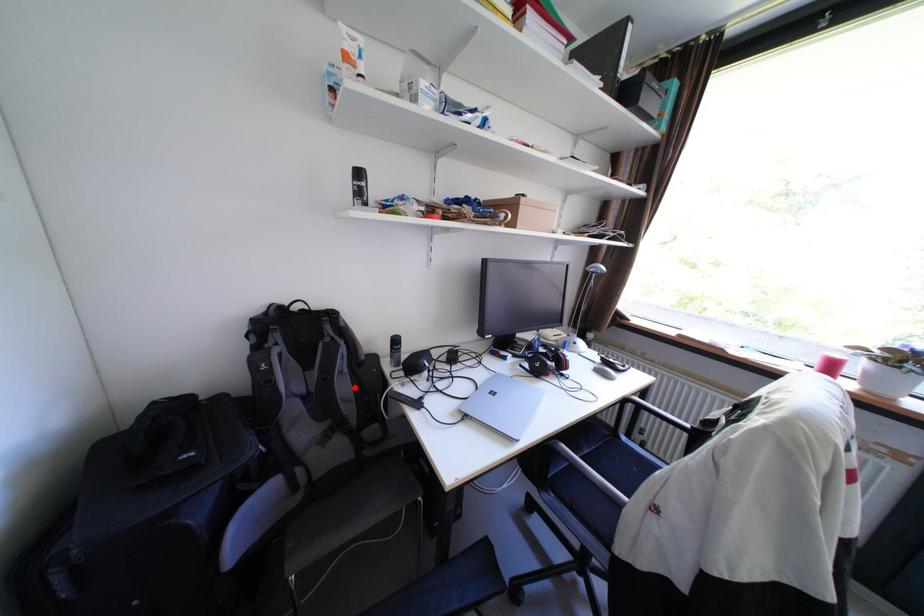
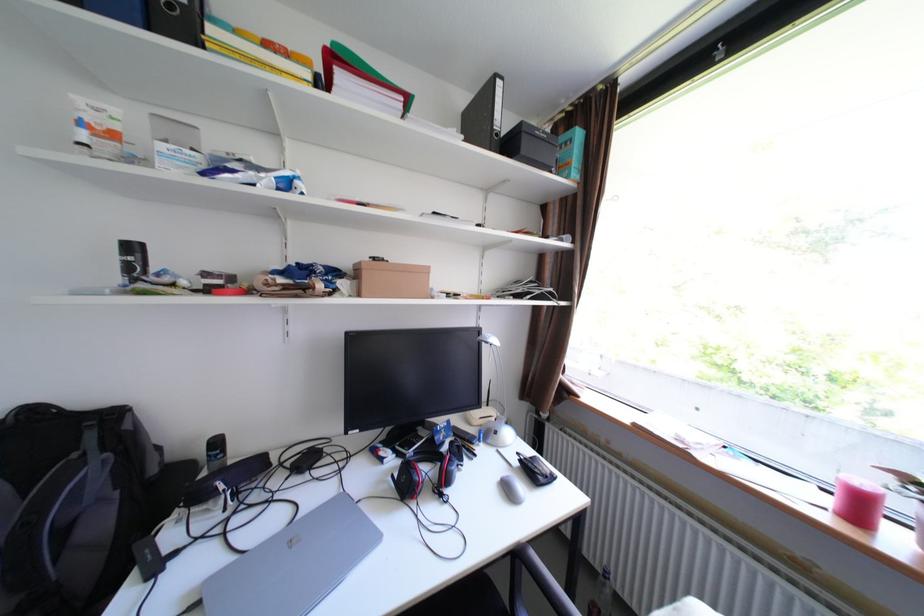
Question: I am providing you with two images of the same scene from different viewpoints. A red point is shown in image1. For the corresponding object point in image2, is it positioned nearer or farther from the camera?

Choices:
 (A) Nearer
 (B) Farther

Answer: (A)